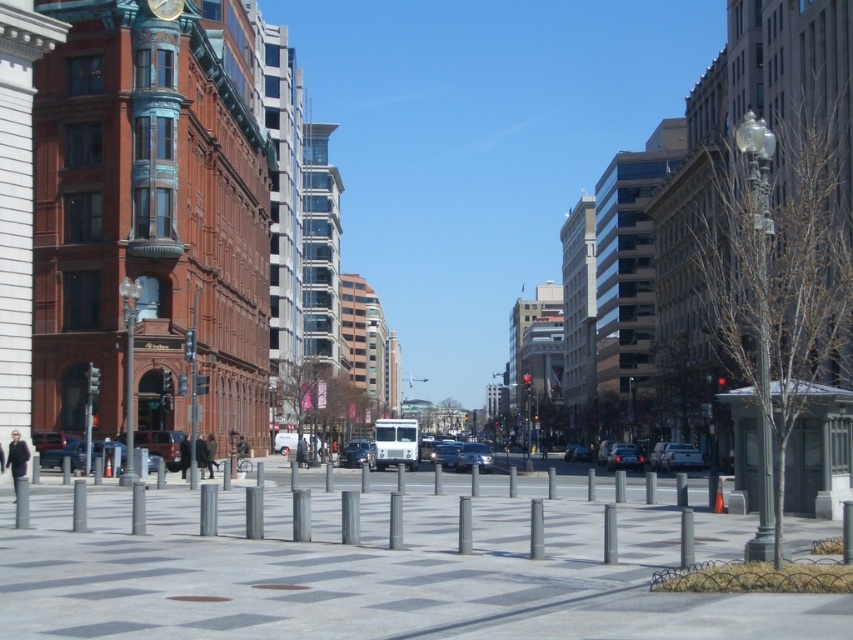
You are a pedestrian standing at the edge of the plaza facing the street. You see a matte black sedan at center and a metallic streetlight at left. Which object is closer to your right side?

The metallic streetlight at left is closer to your right side because the matte black sedan at center is to the left of the metallic streetlight at left, meaning the streetlight is positioned further to the right relative to the sedan.

You are standing at the entrance of the red brick building on the left. You want to walk to the gray concrete pavement at center. Which direction should you head towards?

Since the gray concrete pavement at center is located at point (370,570), you should head towards the center of the plaza to reach it.